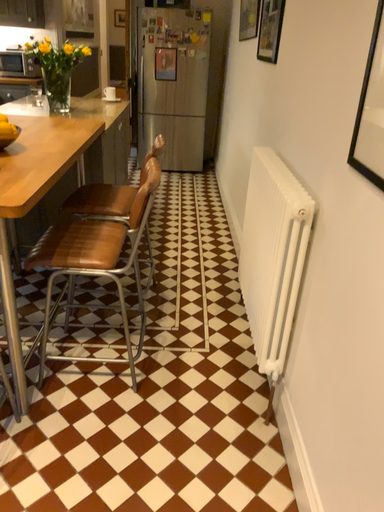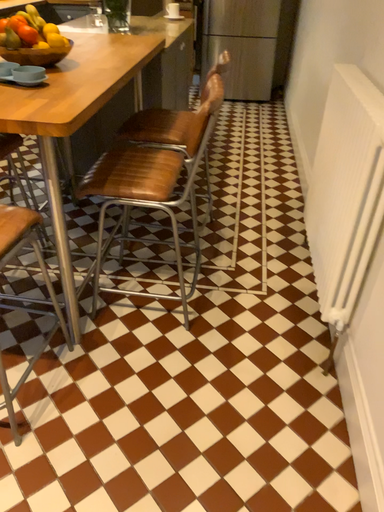
Question: How did the camera likely rotate when shooting the video?

Choices:
 (A) rotated right
 (B) rotated left

Answer: (B)